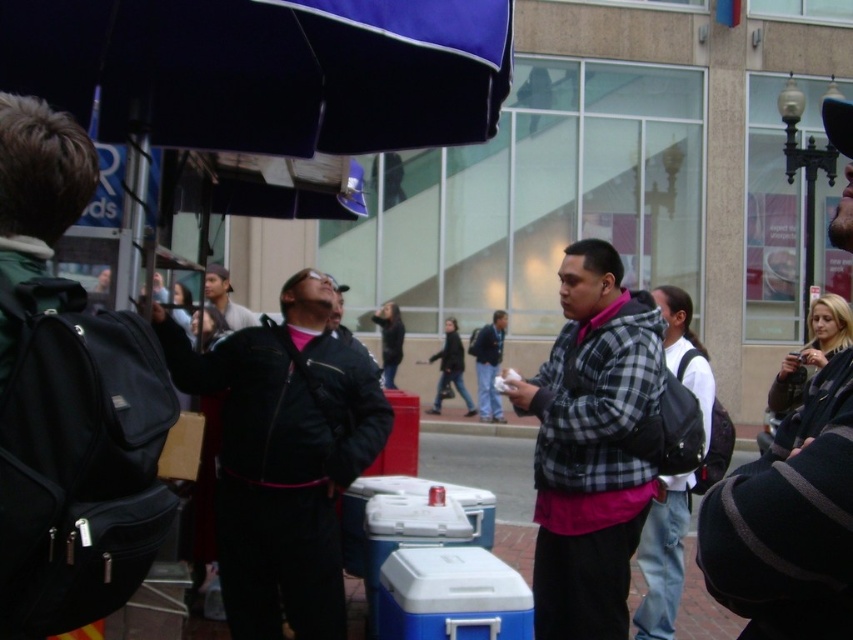
Question: Which is nearer to the black matte jacket at center?

Choices:
 (A) blue fabric umbrella at upper center
 (B) plaid fabric jacket at center
 (C) plaid wool jacket at center
 (D) white plastic cooler at center

Answer: (D)

Question: Among these objects, which one is nearest to the camera?

Choices:
 (A) black matte jacket at center
 (B) white plastic cooler at center
 (C) blue fabric umbrella at upper center
 (D) plaid wool jacket at center

Answer: (D)

Question: Does plaid fabric jacket at center have a larger size compared to white plastic cooler at center?

Choices:
 (A) no
 (B) yes

Answer: (B)

Question: Estimate the real-world distances between objects in this image. Which object is closer to the plaid fabric jacket at center?

Choices:
 (A) plaid wool jacket at center
 (B) blue fabric umbrella at upper center
 (C) white plastic cooler at center
 (D) black matte jacket at center

Answer: (C)

Question: Is blue fabric umbrella at upper center further to camera compared to plaid wool jacket at center?

Choices:
 (A) yes
 (B) no

Answer: (A)

Question: Does blue fabric umbrella at upper center appear on the left side of plaid fabric jacket at center?

Choices:
 (A) yes
 (B) no

Answer: (A)